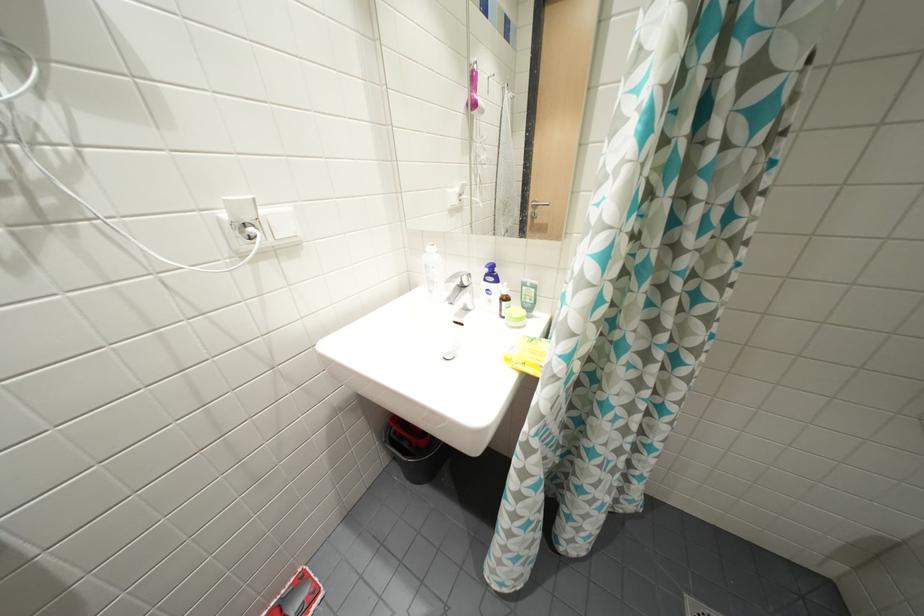
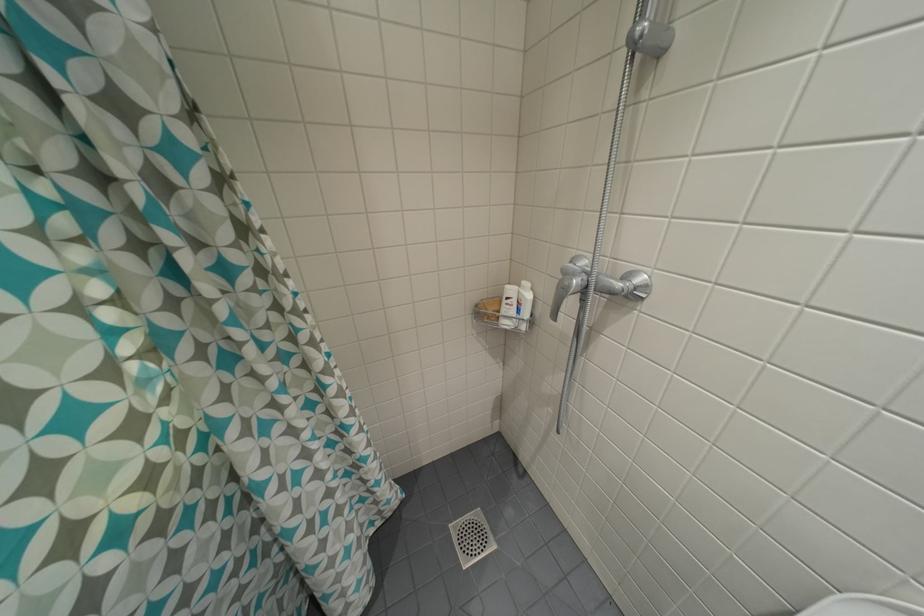
Question: The camera is either moving clockwise (left) or counter-clockwise (right) around the object. The first image is from the beginning of the video and the second image is from the end. Is the camera moving left or right when shooting the video?

Choices:
 (A) Left
 (B) Right

Answer: (A)